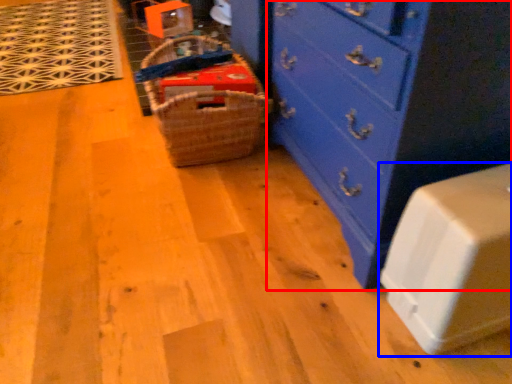
Question: Among these objects, which one is nearest to the camera, chest of drawers (highlighted by a red box) or cabinetry (highlighted by a blue box)?

Choices:
 (A) chest of drawers
 (B) cabinetry

Answer: (B)